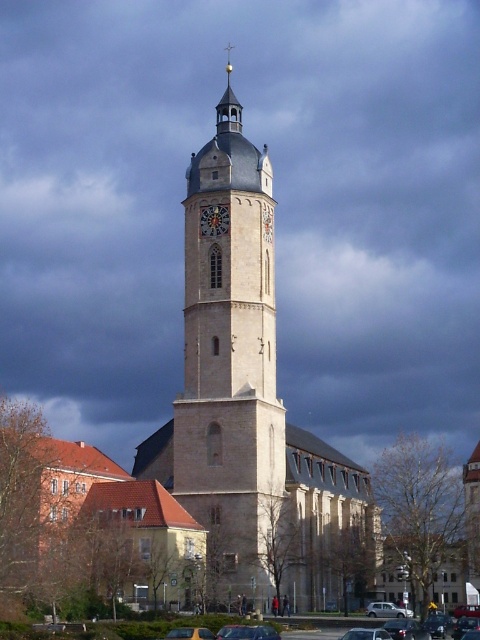
You are a pedestrian standing at the base of the historic church tower. You notice a matte gray clock at center and a yellow matte car at center. Which object is closer to you?

The matte gray clock at center is closer to you because the yellow matte car at center is behind it.

You are a pedestrian standing at the base of the historic church tower and want to cross the street to reach the smaller residential building with a red tiled roof on the left. There are two vehicles in front of you, a metallic silver car at center and a metallic silver sedan at center. Which vehicle do you need to go around first to safely reach the other side?

You need to go around the metallic silver car at center first because it is closer to you than the metallic silver sedan at center.

You are standing on the street looking at the historic church tower. You see the matte gray clock at center and the yellow matte car at center. Which object is higher from the ground?

The matte gray clock at center is positioned over the yellow matte car at center, so the matte gray clock at center is higher from the ground.